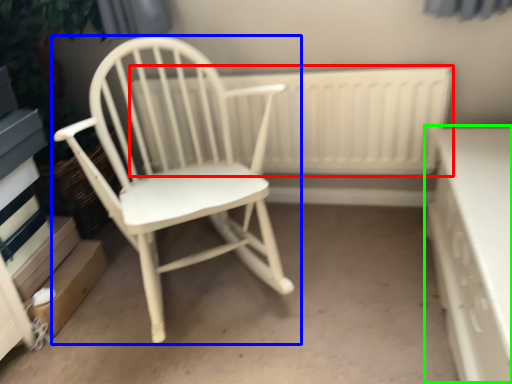
Question: Based on their relative distances, which object is nearer to radiator (highlighted by a red box)? Choose from chair (highlighted by a blue box) and table (highlighted by a green box).

Choices:
 (A) chair
 (B) table

Answer: (A)